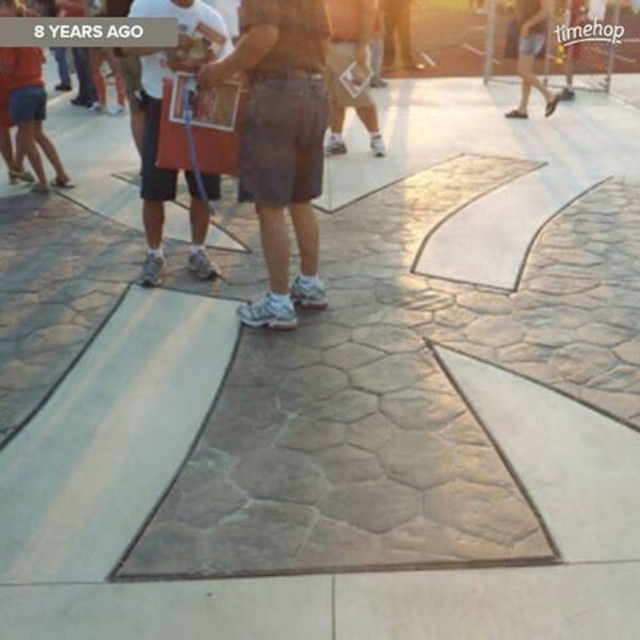
Question: Is brown suede shorts at center closer to camera compared to white denim shorts at upper right?

Choices:
 (A) no
 (B) yes

Answer: (B)

Question: Estimate the real-world distances between objects in this image. Which object is farther from the white denim shorts at upper right?

Choices:
 (A) matte black shorts at center
 (B) brown suede shorts at center
 (C) brown textured shorts at center

Answer: (A)

Question: Which of the following is the farthest from the observer?

Choices:
 (A) (291, 298)
 (B) (150, 230)
 (C) (326, 3)

Answer: (C)

Question: Among these objects, which one is nearest to the camera?

Choices:
 (A) brown suede shorts at center
 (B) white denim shorts at upper right

Answer: (A)

Question: Does brown textured shorts at center lie behind white denim shorts at upper right?

Choices:
 (A) yes
 (B) no

Answer: (B)

Question: Is brown suede shorts at center thinner than brown textured shorts at center?

Choices:
 (A) no
 (B) yes

Answer: (A)